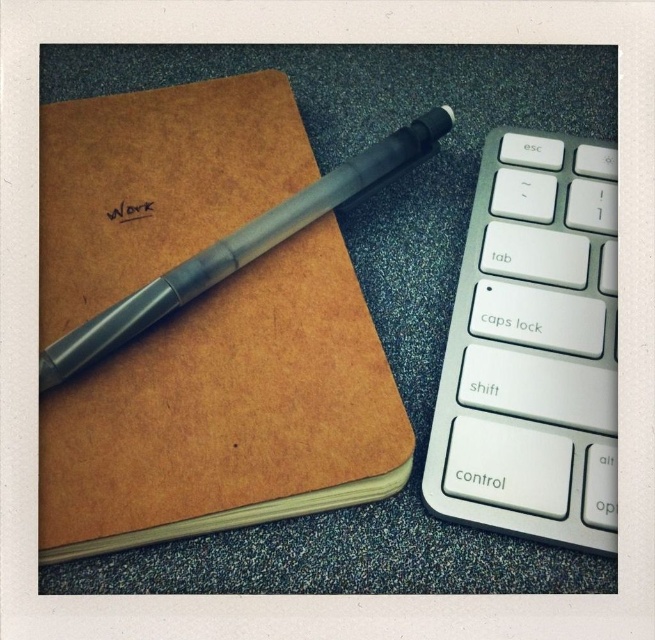
Does brown leather notebook at upper left appear on the left side of silver metallic keyboard at right?

Indeed, brown leather notebook at upper left is positioned on the left side of silver metallic keyboard at right.

Is brown leather notebook at upper left closer to camera compared to silver metallic keyboard at right?

Yes, it is in front of silver metallic keyboard at right.

Is point (322, 288) in front of point (504, 429)?

No.

Locate an element on the screen. The height and width of the screenshot is (640, 655). brown leather notebook at upper left is located at coordinates (229, 412).